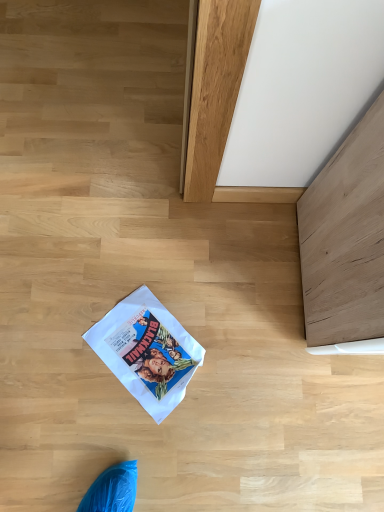
Image resolution: width=384 pixels, height=512 pixels. Identify the location of free space in front of white paper at center. (126, 439).